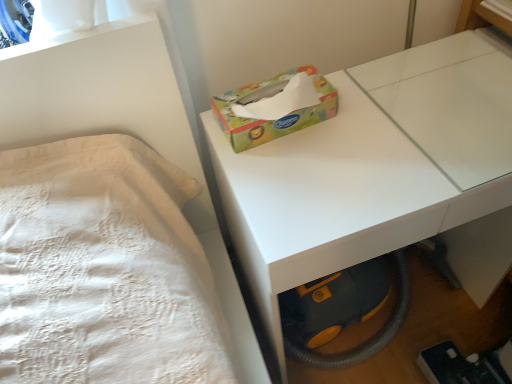
Identify the location of free space in front of multicolored cardboard tissue box at center. [306, 178].